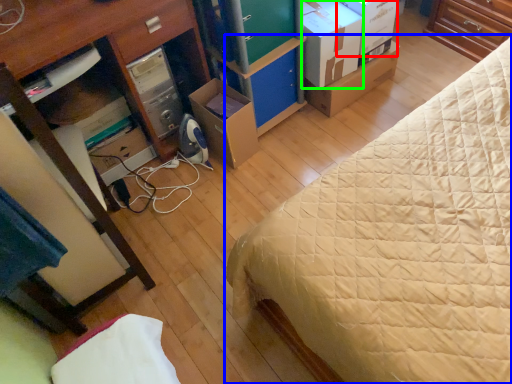
Question: Estimate the real-world distances between objects in this image. Which object is closer to storage box (highlighted by a red box), bed (highlighted by a blue box) or cardboard box (highlighted by a green box)?

Choices:
 (A) bed
 (B) cardboard box

Answer: (B)